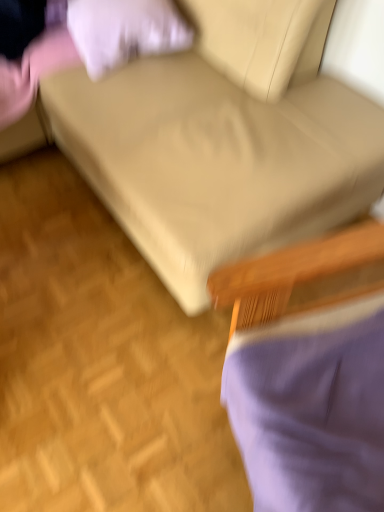
Question: Is beige fabric couch at center outside purple fabric chair at lower right?

Choices:
 (A) yes
 (B) no

Answer: (A)

Question: Does beige fabric couch at center have a lesser width compared to purple fabric chair at lower right?

Choices:
 (A) yes
 (B) no

Answer: (B)

Question: Is there a large distance between beige fabric couch at center and purple fabric chair at lower right?

Choices:
 (A) no
 (B) yes

Answer: (A)

Question: Considering the relative sizes of beige fabric couch at center and purple fabric chair at lower right in the image provided, is beige fabric couch at center shorter than purple fabric chair at lower right?

Choices:
 (A) no
 (B) yes

Answer: (A)

Question: Considering the relative positions of beige fabric couch at center and purple fabric chair at lower right in the image provided, is beige fabric couch at center to the right of purple fabric chair at lower right from the viewer's perspective?

Choices:
 (A) yes
 (B) no

Answer: (B)

Question: Looking at their shapes, would you say purple fabric chair at lower right is wider or thinner than white soft pillow at upper left?

Choices:
 (A) wide
 (B) thin

Answer: (A)

Question: Considering the positions of point (289, 264) and point (84, 40), is point (289, 264) closer or farther from the camera than point (84, 40)?

Choices:
 (A) closer
 (B) farther

Answer: (A)

Question: From their relative heights in the image, would you say purple fabric chair at lower right is taller or shorter than white soft pillow at upper left?

Choices:
 (A) tall
 (B) short

Answer: (A)

Question: Based on their sizes in the image, would you say purple fabric chair at lower right is bigger or smaller than white soft pillow at upper left?

Choices:
 (A) big
 (B) small

Answer: (A)

Question: In the image, is purple fabric chair at lower right on the left side or the right side of beige fabric couch at center?

Choices:
 (A) left
 (B) right

Answer: (B)

Question: In terms of size, does purple fabric chair at lower right appear bigger or smaller than beige fabric couch at center?

Choices:
 (A) big
 (B) small

Answer: (B)

Question: From the image's perspective, is purple fabric chair at lower right above or below beige fabric couch at center?

Choices:
 (A) above
 (B) below

Answer: (B)

Question: Is point (377, 303) closer or farther from the camera than point (173, 86)?

Choices:
 (A) closer
 (B) farther

Answer: (A)

Question: From a real-world perspective, is beige fabric couch at center above or below white soft pillow at upper left?

Choices:
 (A) below
 (B) above

Answer: (B)

Question: Would you say beige fabric couch at center is to the left or to the right of white soft pillow at upper left in the picture?

Choices:
 (A) right
 (B) left

Answer: (A)